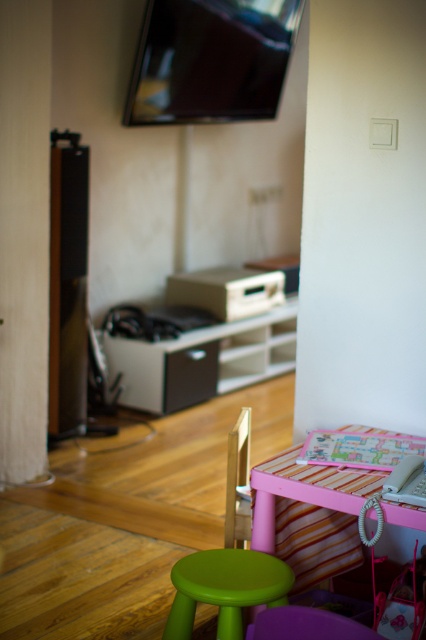
Does point (158, 108) lie in front of point (247, 445)?

No.

Does flat screen tv at upper center have a greater height compared to wooden chair at center?

Yes, flat screen tv at upper center is taller than wooden chair at center.

Does point (244, 61) come behind point (233, 451)?

That is True.

This screenshot has height=640, width=426. Identify the location of flat screen tv at upper center. (210, 60).

How much distance is there between green matte stool at lower center and wooden chair at center?

green matte stool at lower center is 46.76 centimeters from wooden chair at center.

Does green matte stool at lower center appear over wooden chair at center?

No.

Which is behind, point (203, 552) or point (247, 420)?

The point (247, 420) is behind.

Locate an element on the screen. green matte stool at lower center is located at coordinates (224, 588).

Is point (273, 579) behind point (304, 636)?

That is True.

Does green matte stool at lower center appear on the right side of purple plastic chair at lower center?

Incorrect, green matte stool at lower center is not on the right side of purple plastic chair at lower center.

What do you see at coordinates (224, 588) in the screenshot?
I see `green matte stool at lower center` at bounding box center [224, 588].

This screenshot has height=640, width=426. I want to click on green matte stool at lower center, so tap(224, 588).